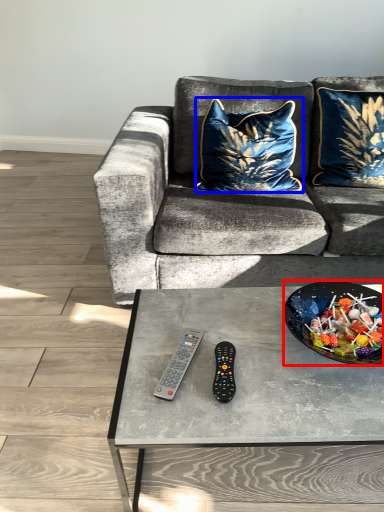
Question: Among these objects, which one is farthest to the camera, bowl (highlighted by a red box) or pillow (highlighted by a blue box)?

Choices:
 (A) bowl
 (B) pillow

Answer: (B)